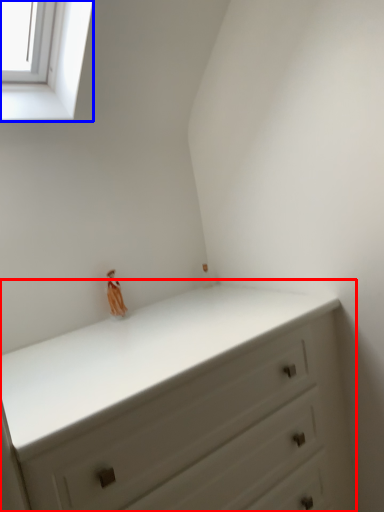
Question: Which point is further to the camera, chest of drawers (highlighted by a red box) or window (highlighted by a blue box)?

Choices:
 (A) chest of drawers
 (B) window

Answer: (B)